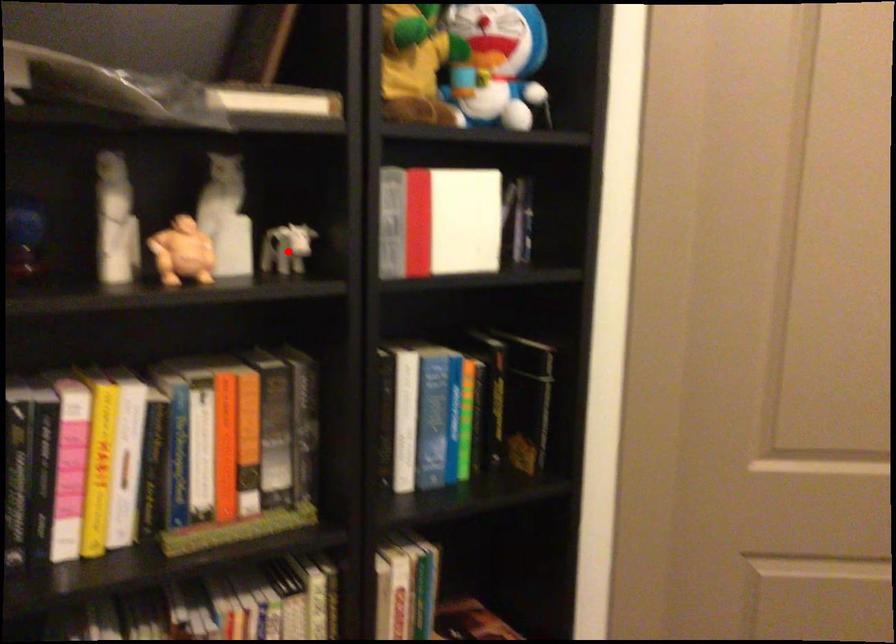
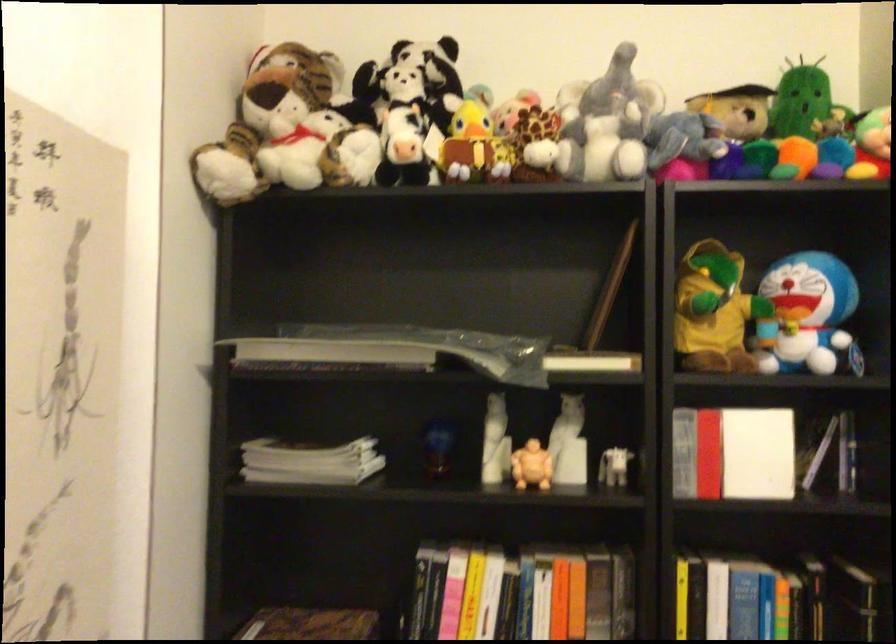
The point at the highlighted location is marked in the first image. Where is the corresponding point in the second image?

(615, 468)